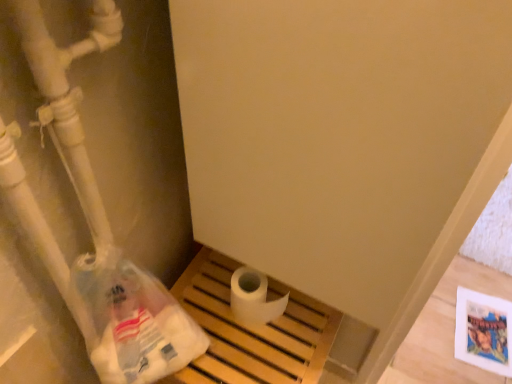
What do you see at coordinates (253, 298) in the screenshot?
I see `white matte toilet paper at center` at bounding box center [253, 298].

Locate an element on the screen. The image size is (512, 384). white matte toilet paper at center is located at coordinates (253, 298).

What is the approximate height of white matte toilet paper at center?

It is 15.23 centimeters.

Measure the distance between white matte toilet paper at center and camera.

The distance of white matte toilet paper at center from camera is 34.17 inches.

Measure the distance between point (104, 263) and camera.

The distance of point (104, 263) from camera is 26.06 inches.

Find the location of a particular element. translucent plastic bag at lower left is located at coordinates (135, 322).

What do you see at coordinates (135, 322) in the screenshot? The image size is (512, 384). I see `translucent plastic bag at lower left` at bounding box center [135, 322].

At what (x,y) coordinates should I click in order to perform the action: click on white matte toilet paper at center. Please return your answer as a coordinate pair (x, y). The height and width of the screenshot is (384, 512). Looking at the image, I should click on (253, 298).

Can you confirm if translucent plastic bag at lower left is positioned to the left of white matte toilet paper at center?

Yes, translucent plastic bag at lower left is to the left of white matte toilet paper at center.

Considering the relative positions of translucent plastic bag at lower left and white matte toilet paper at center in the image provided, is translucent plastic bag at lower left behind white matte toilet paper at center?

No, translucent plastic bag at lower left is in front of white matte toilet paper at center.

Is point (118, 365) positioned before point (254, 279)?

Yes, point (118, 365) is closer to viewer.

From the image's perspective, does translucent plastic bag at lower left appear higher than white matte toilet paper at center?

No, from the image's perspective, translucent plastic bag at lower left is not on top of white matte toilet paper at center.

From a real-world perspective, between translucent plastic bag at lower left and white matte toilet paper at center, who is vertically higher?

In real-world perspective, translucent plastic bag at lower left is above.

Does translucent plastic bag at lower left have a lesser width compared to white matte toilet paper at center?

Incorrect, the width of translucent plastic bag at lower left is not less than that of white matte toilet paper at center.

Which of these two, translucent plastic bag at lower left or white matte toilet paper at center, stands taller?

With more height is translucent plastic bag at lower left.

Considering the sizes of objects translucent plastic bag at lower left and white matte toilet paper at center in the image provided, who is bigger, translucent plastic bag at lower left or white matte toilet paper at center?

Bigger between the two is translucent plastic bag at lower left.

Is white matte toilet paper at center located within translucent plastic bag at lower left?

No.

Are translucent plastic bag at lower left and white matte toilet paper at center located far from each other?

They are positioned close to each other.

Consider the image. Is translucent plastic bag at lower left oriented towards white matte toilet paper at center?

No, translucent plastic bag at lower left is not turned towards white matte toilet paper at center.

How many degrees apart are the facing directions of translucent plastic bag at lower left and white matte toilet paper at center?

0.000632 degrees.

The image size is (512, 384). Identify the location of paper bag that is on the left side of white matte toilet paper at center. pyautogui.click(x=135, y=322).

Considering the relative positions of white matte toilet paper at center and translucent plastic bag at lower left in the image provided, is white matte toilet paper at center to the left of translucent plastic bag at lower left from the viewer's perspective?

In fact, white matte toilet paper at center is to the right of translucent plastic bag at lower left.

From the picture: Is the depth of white matte toilet paper at center less than that of translucent plastic bag at lower left?

No, white matte toilet paper at center is further to the viewer.

Considering the positions of point (259, 314) and point (133, 377), is point (259, 314) closer or farther from the camera than point (133, 377)?

Point (259, 314).

From the image's perspective, is white matte toilet paper at center below translucent plastic bag at lower left?

Incorrect, from the image's perspective, white matte toilet paper at center is higher than translucent plastic bag at lower left.

From a real-world perspective, is white matte toilet paper at center on top of translucent plastic bag at lower left?

No.

Can you confirm if white matte toilet paper at center is thinner than translucent plastic bag at lower left?

Yes.

Is white matte toilet paper at center taller or shorter than translucent plastic bag at lower left?

In the image, white matte toilet paper at center appears to be shorter than translucent plastic bag at lower left.

Who is bigger, white matte toilet paper at center or translucent plastic bag at lower left?

translucent plastic bag at lower left is bigger.

Is white matte toilet paper at center situated inside translucent plastic bag at lower left or outside?

white matte toilet paper at center is spatially situated outside translucent plastic bag at lower left.

Is white matte toilet paper at center next to translucent plastic bag at lower left and touching it?

There is a gap between white matte toilet paper at center and translucent plastic bag at lower left.

Could you tell me if white matte toilet paper at center is turned towards translucent plastic bag at lower left?

No, white matte toilet paper at center is not turned towards translucent plastic bag at lower left.

What's the angular difference between white matte toilet paper at center and translucent plastic bag at lower left's facing directions?

The angular difference between white matte toilet paper at center and translucent plastic bag at lower left is 0.000632 degrees.

Measure the distance from white matte toilet paper at center to translucent plastic bag at lower left.

white matte toilet paper at center and translucent plastic bag at lower left are 19.37 centimeters apart.

Find the location of a particular element. toilet paper that is on the right side of translucent plastic bag at lower left is located at coordinates (253, 298).

Identify the location of paper bag on the left of white matte toilet paper at center. (135, 322).

Locate an element on the screen. The width and height of the screenshot is (512, 384). paper bag that is above the white matte toilet paper at center (from a real-world perspective) is located at coordinates (135, 322).